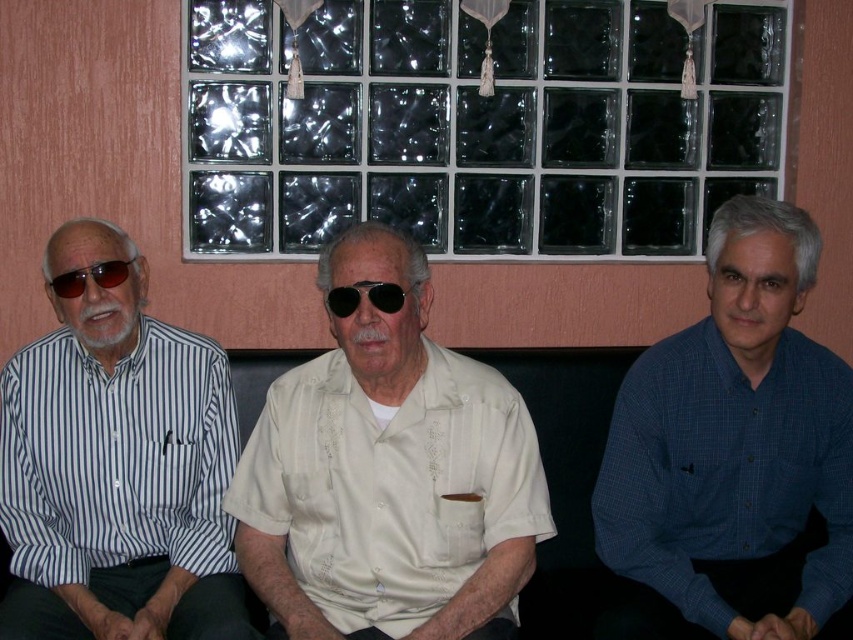
Find the location of a particular element. The image size is (853, 640). blue striped shirt at left is located at coordinates (115, 467).

Identify the location of blue striped shirt at left. Image resolution: width=853 pixels, height=640 pixels. (115, 467).

Locate an element on the screen. This screenshot has width=853, height=640. blue striped shirt at left is located at coordinates (115, 467).

Between blue checkered shirt at right and black reflective sunglasses at center, which one has more height?

Standing taller between the two is blue checkered shirt at right.

Which is in front, point (676, 632) or point (386, 300)?

Point (386, 300) is in front.

At what (x,y) coordinates should I click in order to perform the action: click on blue checkered shirt at right. Please return your answer as a coordinate pair (x, y). Image resolution: width=853 pixels, height=640 pixels. Looking at the image, I should click on (733, 451).

Who is taller, matte beige shirt at center or blue checkered shirt at right?

blue checkered shirt at right

Does matte beige shirt at center have a larger size compared to blue checkered shirt at right?

No, matte beige shirt at center is not bigger than blue checkered shirt at right.

At what (x,y) coordinates should I click in order to perform the action: click on matte beige shirt at center. Please return your answer as a coordinate pair (x, y). This screenshot has height=640, width=853. Looking at the image, I should click on (387, 472).

This screenshot has width=853, height=640. I want to click on matte beige shirt at center, so 387,472.